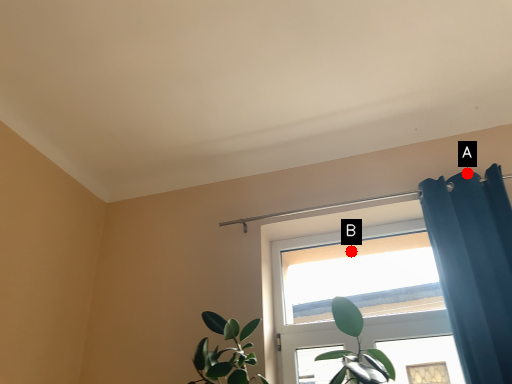
Question: Two points are circled on the image, labeled by A and B beside each circle. Which point is farther from the camera taking this photo?

Choices:
 (A) A is further
 (B) B is further

Answer: (B)